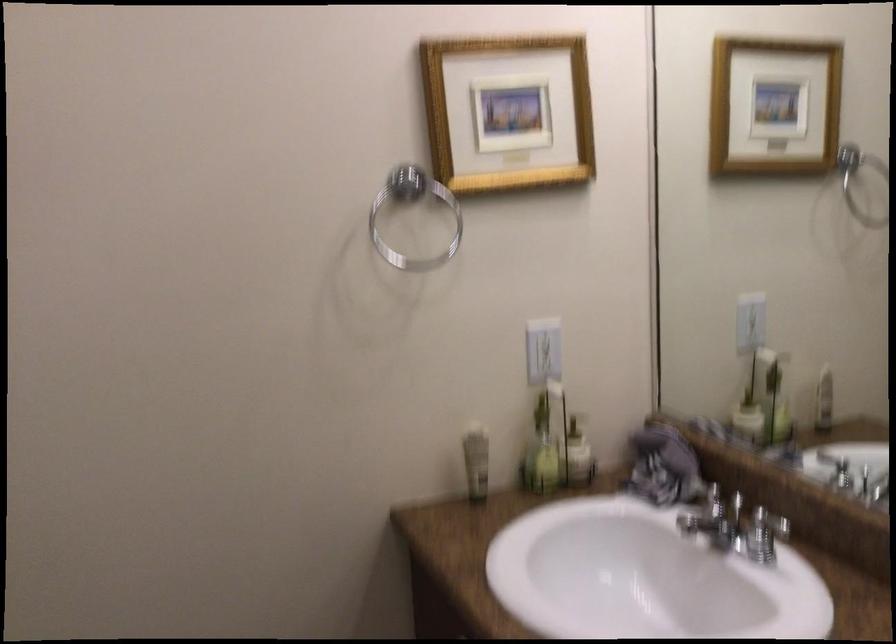
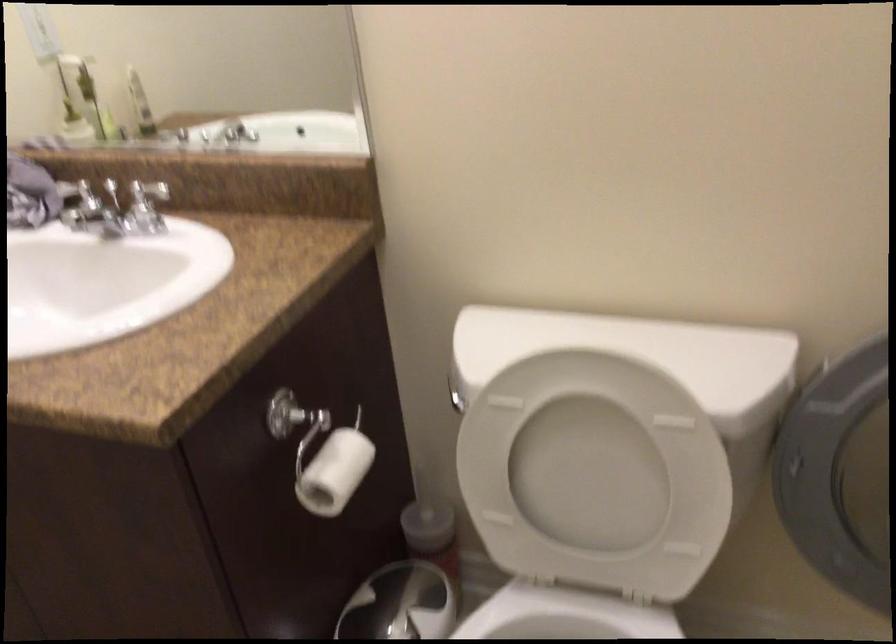
First-person continuous shooting, in which direction is the camera rotating?

The camera's rotation is toward right-down.